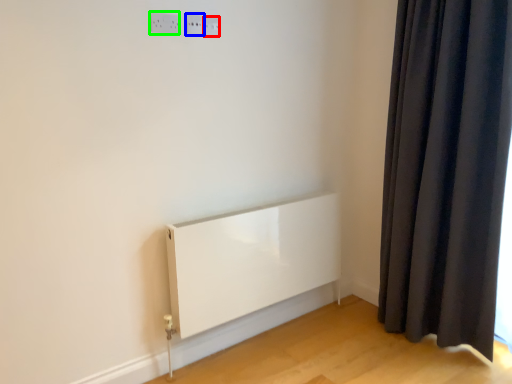
Question: Which object is the farthest from electric outlet (highlighted by a red box)? Choose among these: electric outlet (highlighted by a blue box) or electric outlet (highlighted by a green box).

Choices:
 (A) electric outlet
 (B) electric outlet

Answer: (B)